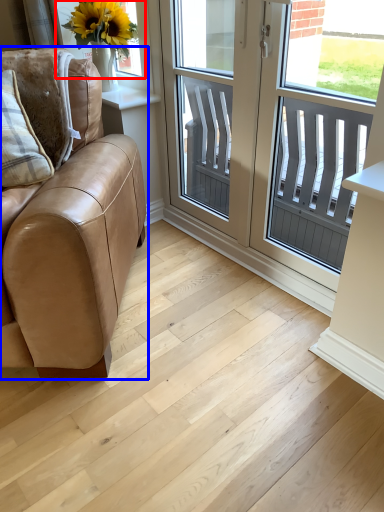
Question: Among these objects, which one is farthest to the camera, window screen (highlighted by a red box) or studio couch (highlighted by a blue box)?

Choices:
 (A) window screen
 (B) studio couch

Answer: (A)